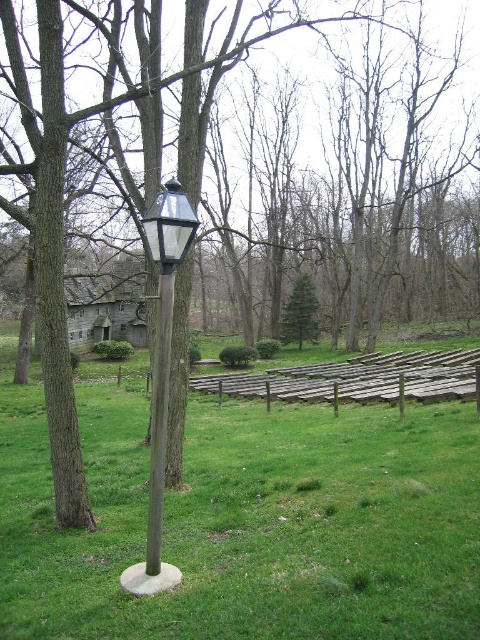
Who is taller, brown wooden fence at center or clear glass lamp post at center?

With more height is clear glass lamp post at center.

Which is behind, point (273, 397) or point (149, 484)?

The point (273, 397) is more distant.

What are the coordinates of `brown wooden fence at center` in the screenshot? It's located at (357, 378).

Is brown wooden fence at center above green matte evergreen tree at center?

No.

Which is behind, point (319, 378) or point (288, 337)?

Point (288, 337)

Where is `brown wooden fence at center`? This screenshot has height=640, width=480. brown wooden fence at center is located at coordinates (357, 378).

Which is in front, point (164, 301) or point (152, 573)?

Point (152, 573)

Is clear glass lamp post at center thinner than smooth wooden post at center?

No.

This screenshot has width=480, height=640. Identify the location of clear glass lamp post at center. coord(162,376).